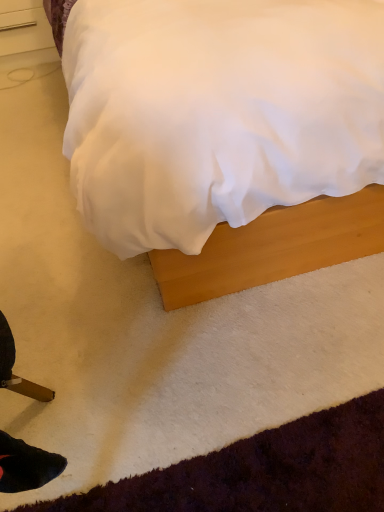
The image size is (384, 512). Identify the location of wooden bed at center. (273, 247).

Describe the element at coordinates (273, 247) in the screenshot. I see `wooden bed at center` at that location.

Find the location of a particular element. Image resolution: width=384 pixels, height=512 pixels. brushed metal drawer at upper left is located at coordinates (24, 32).

This screenshot has height=512, width=384. Describe the element at coordinates (24, 32) in the screenshot. I see `brushed metal drawer at upper left` at that location.

I want to click on wooden bed at center, so click(273, 247).

Would you say brushed metal drawer at upper left is to the left or to the right of wooden bed at center in the picture?

From the image, it's evident that brushed metal drawer at upper left is to the left of wooden bed at center.

Based on the photo, is brushed metal drawer at upper left positioned behind wooden bed at center?

Yes, brushed metal drawer at upper left is behind wooden bed at center.

Which is behind, point (11, 19) or point (187, 274)?

The point (11, 19) is behind.

From the image's perspective, which is above, brushed metal drawer at upper left or wooden bed at center?

From the image's view, brushed metal drawer at upper left is above.

From a real-world perspective, who is located higher, brushed metal drawer at upper left or wooden bed at center?

In real-world perspective, wooden bed at center is above.

Is brushed metal drawer at upper left thinner than wooden bed at center?

Yes.

Between brushed metal drawer at upper left and wooden bed at center, which one has less height?

Standing shorter between the two is brushed metal drawer at upper left.

Which of these two, brushed metal drawer at upper left or wooden bed at center, is bigger?

With larger size is wooden bed at center.

Choose the correct answer: Is brushed metal drawer at upper left inside wooden bed at center or outside it?

brushed metal drawer at upper left is not inside wooden bed at center, it's outside.

Are brushed metal drawer at upper left and wooden bed at center making contact?

No.

Is brushed metal drawer at upper left oriented towards wooden bed at center?

No.

How different are the orientations of brushed metal drawer at upper left and wooden bed at center in degrees?

The angular difference between brushed metal drawer at upper left and wooden bed at center is 1.82 degrees.

Find the location of a particular element. drawer behind the wooden bed at center is located at coordinates (24, 32).

Based on the photo, which object is positioned more to the left, wooden bed at center or brushed metal drawer at upper left?

brushed metal drawer at upper left is more to the left.

From the picture: Is wooden bed at center further to camera compared to brushed metal drawer at upper left?

No.

Is point (378, 196) closer or farther from the camera than point (39, 46)?

Point (378, 196) is positioned closer to the camera compared to point (39, 46).

From the image's perspective, is wooden bed at center positioned above or below brushed metal drawer at upper left?

wooden bed at center is below brushed metal drawer at upper left.

From a real-world perspective, is wooden bed at center under brushed metal drawer at upper left?

Incorrect, from a real-world perspective, wooden bed at center is higher than brushed metal drawer at upper left.

Between wooden bed at center and brushed metal drawer at upper left, which one has larger width?

Wider between the two is wooden bed at center.

In terms of height, does wooden bed at center look taller or shorter compared to brushed metal drawer at upper left?

In the image, wooden bed at center appears to be taller than brushed metal drawer at upper left.

Considering the sizes of wooden bed at center and brushed metal drawer at upper left in the image, is wooden bed at center bigger or smaller than brushed metal drawer at upper left?

wooden bed at center is bigger than brushed metal drawer at upper left.

Which is correct: wooden bed at center is inside brushed metal drawer at upper left, or outside of it?

wooden bed at center is outside brushed metal drawer at upper left.

Is wooden bed at center placed right next to brushed metal drawer at upper left?

There is a gap between wooden bed at center and brushed metal drawer at upper left.

Is wooden bed at center facing towards brushed metal drawer at upper left?

No, wooden bed at center does not turn towards brushed metal drawer at upper left.

What's the angular difference between wooden bed at center and brushed metal drawer at upper left's facing directions?

The angle between the facing direction of wooden bed at center and the facing direction of brushed metal drawer at upper left is 1.82 degrees.

Measure the distance from wooden bed at center to brushed metal drawer at upper left.

A distance of 1.74 meters exists between wooden bed at center and brushed metal drawer at upper left.

Locate an element on the screen. drawer above the wooden bed at center (from the image's perspective) is located at coordinates (24, 32).

This screenshot has height=512, width=384. Find the location of `bed positioned vertically above the brushed metal drawer at upper left (from a real-world perspective)`. bed positioned vertically above the brushed metal drawer at upper left (from a real-world perspective) is located at coordinates (273, 247).

At what (x,y) coordinates should I click in order to perform the action: click on drawer below the wooden bed at center (from a real-world perspective). Please return your answer as a coordinate pair (x, y). This screenshot has width=384, height=512. Looking at the image, I should click on (24, 32).